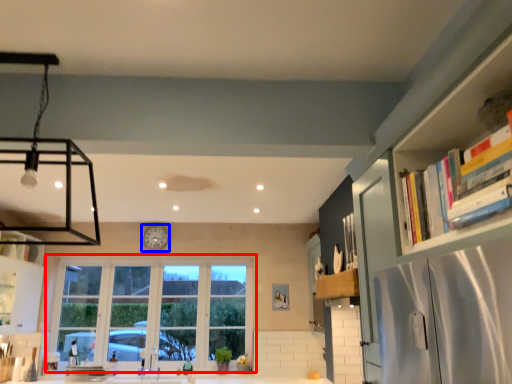
Question: Which object appears closest to the camera in this image, window (highlighted by a red box) or clock (highlighted by a blue box)?

Choices:
 (A) window
 (B) clock

Answer: (A)